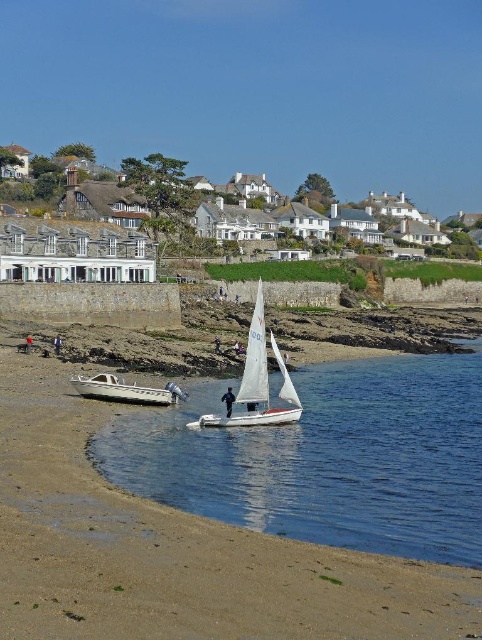
Question: Considering the real-world distances, which object is closest to the dark blue fabric sailboat at center?

Choices:
 (A) clear blue water at center
 (B) dark blue fabric jacket at lower left
 (C) white plastic dinghy at lower left

Answer: (C)

Question: Among these points, which one is nearest to the camera?

Choices:
 (A) (170, 394)
 (B) (59, 339)

Answer: (A)

Question: Which point is closer to the camera?

Choices:
 (A) (216, 353)
 (B) (384, 468)

Answer: (B)

Question: Does white sailboat at center lie behind dark blue fabric jacket at lower left?

Choices:
 (A) no
 (B) yes

Answer: (A)

Question: Does white sailboat at center lie in front of dark blue fabric sailboat at center?

Choices:
 (A) yes
 (B) no

Answer: (A)

Question: Can you confirm if clear blue water at center is positioned to the left of dark blue jeans at lower left?

Choices:
 (A) no
 (B) yes

Answer: (A)